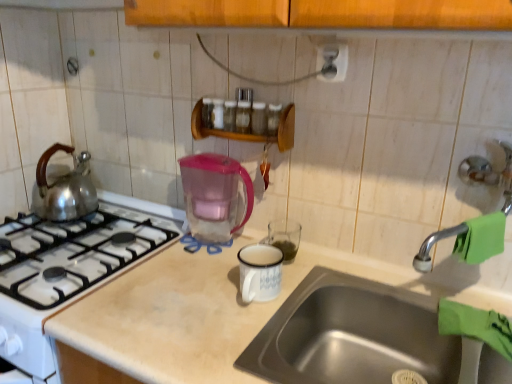
Question: Should I look upward or downward to see transparent plastic pitcher at center?

Choices:
 (A) down
 (B) up

Answer: (A)

Question: Is satin silver outlet at upper center smaller than wooden spice rack at upper center?

Choices:
 (A) yes
 (B) no

Answer: (A)

Question: Can you confirm if satin silver outlet at upper center is positioned to the right of wooden spice rack at upper center?

Choices:
 (A) yes
 (B) no

Answer: (A)

Question: From a real-world perspective, does satin silver outlet at upper center stand above wooden spice rack at upper center?

Choices:
 (A) no
 (B) yes

Answer: (B)

Question: Is wooden spice rack at upper center surrounded by satin silver outlet at upper center?

Choices:
 (A) yes
 (B) no

Answer: (B)

Question: From the image's perspective, would you say satin silver outlet at upper center is shown under wooden spice rack at upper center?

Choices:
 (A) no
 (B) yes

Answer: (A)

Question: Would you consider satin silver outlet at upper center to be distant from wooden spice rack at upper center?

Choices:
 (A) yes
 (B) no

Answer: (B)

Question: From a real-world perspective, is stainless steel sink at lower right over transparent plastic pitcher at center?

Choices:
 (A) yes
 (B) no

Answer: (B)

Question: From a real-world perspective, is stainless steel sink at lower right positioned under transparent plastic pitcher at center based on gravity?

Choices:
 (A) no
 (B) yes

Answer: (B)

Question: Does stainless steel sink at lower right have a larger size compared to transparent plastic pitcher at center?

Choices:
 (A) no
 (B) yes

Answer: (B)

Question: Can you confirm if stainless steel sink at lower right is positioned to the right of transparent plastic pitcher at center?

Choices:
 (A) yes
 (B) no

Answer: (A)

Question: From the image's perspective, is stainless steel sink at lower right under transparent plastic pitcher at center?

Choices:
 (A) no
 (B) yes

Answer: (B)

Question: Is transparent plastic pitcher at center at the back of stainless steel sink at lower right?

Choices:
 (A) yes
 (B) no

Answer: (B)

Question: Does green rubber faucet at right have a lesser width compared to wooden spice rack at upper center?

Choices:
 (A) no
 (B) yes

Answer: (B)